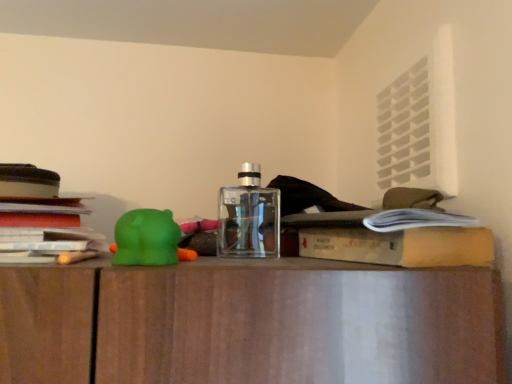
Question: Based on their positions, is green rubber bear at left located to the left or right of hardcover book at center?

Choices:
 (A) right
 (B) left

Answer: (B)

Question: Looking at their shapes, would you say green rubber bear at left is wider or thinner than hardcover book at center?

Choices:
 (A) wide
 (B) thin

Answer: (B)

Question: Estimate the real-world distances between objects in this image. Which object is farther from the transparent glass bottle at center?

Choices:
 (A) green rubber bear at left
 (B) stacked paper at left
 (C) hardcover book at center

Answer: (B)

Question: Based on their relative distances, which object is farther from the green rubber bear at left?

Choices:
 (A) hardcover book at center
 (B) transparent glass bottle at center
 (C) stacked paper at left

Answer: (A)